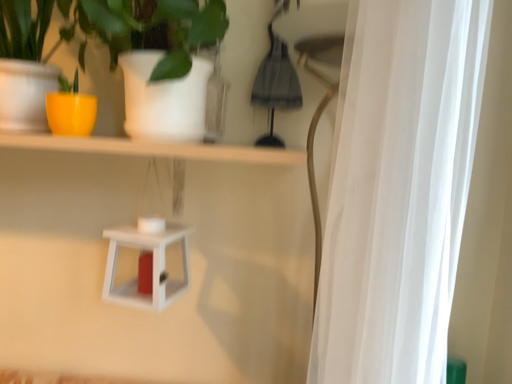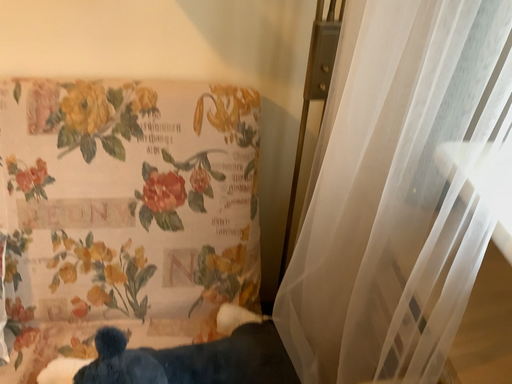
Question: Which way did the camera rotate in the video?

Choices:
 (A) rotated downward
 (B) rotated upward

Answer: (A)